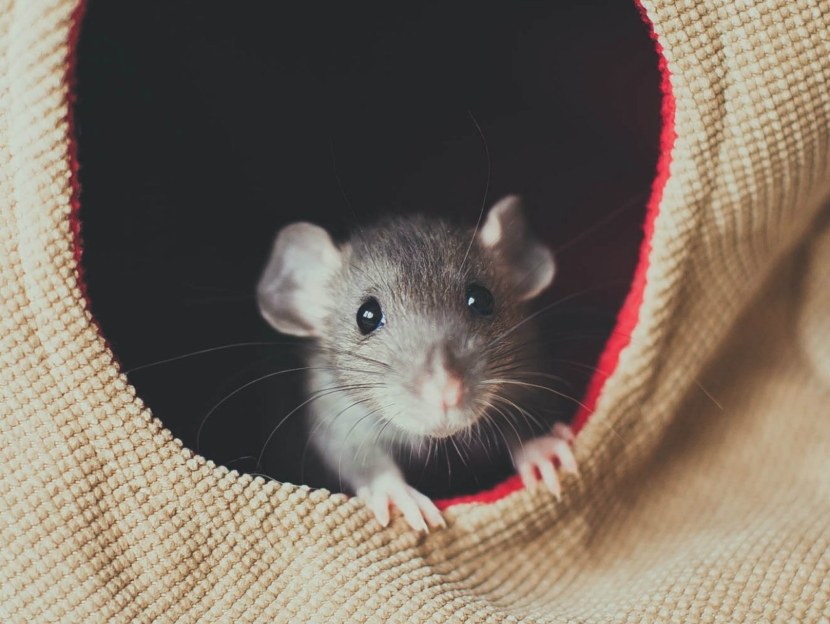
The image size is (830, 624). What are the coordinates of `mouse` in the screenshot? It's located at (418, 336).